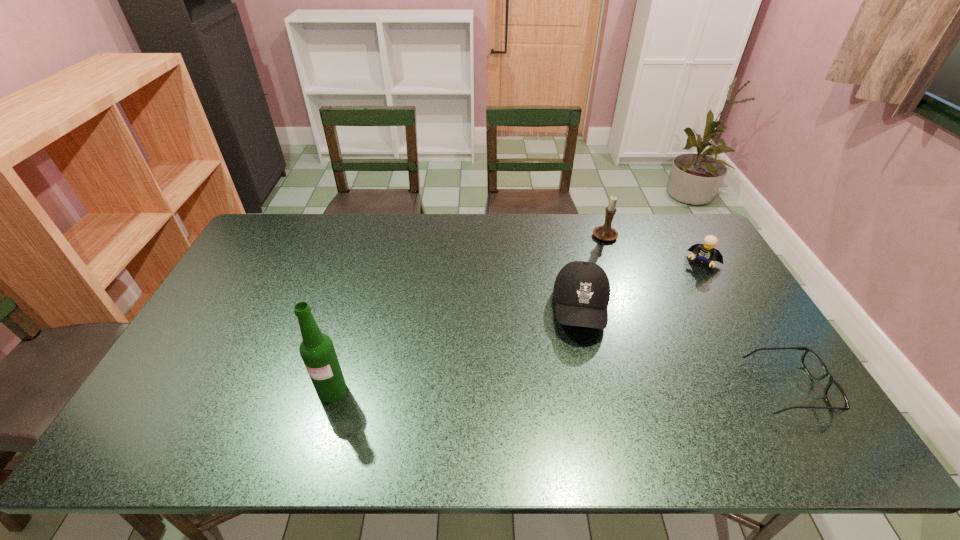
This screenshot has height=540, width=960. What are the coordinates of `the leftmost object` in the screenshot? It's located at (317, 350).

Identify the location of beer bottle. (317, 350).

This screenshot has width=960, height=540. Identify the location of spectacles. (835, 397).

The height and width of the screenshot is (540, 960). I want to click on the third nearest object, so click(x=581, y=290).

Find the location of `the second object from left to right`. the second object from left to right is located at coordinates (581, 290).

Where is `the fourth nearest object`? This screenshot has width=960, height=540. the fourth nearest object is located at coordinates (706, 252).

Where is `candle holder`? The height and width of the screenshot is (540, 960). candle holder is located at coordinates (605, 233).

Where is `the farthest object`? This screenshot has height=540, width=960. the farthest object is located at coordinates (605, 233).

Identify the location of vacant space positioned 0.060m on the front-facing side of the fourth object from right to left. (585, 361).

Image resolution: width=960 pixels, height=540 pixels. Identify the location of vacant space located on the front-facing side of the fourth object from right to left. (587, 414).